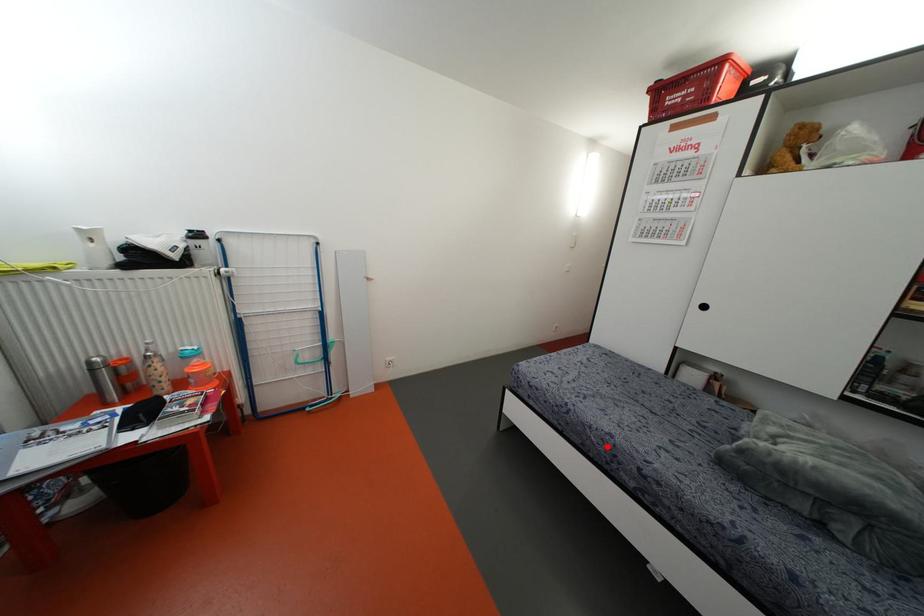
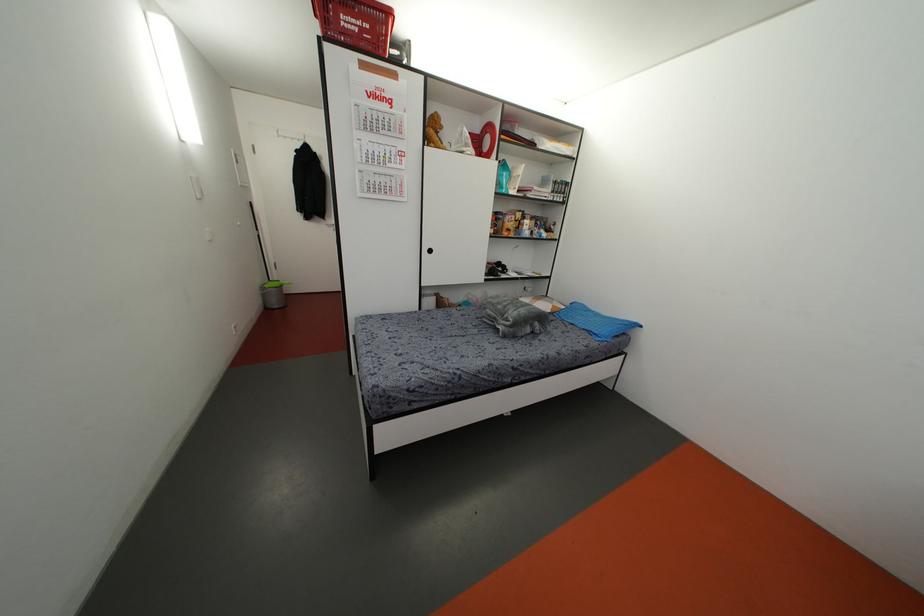
The point at the highlighted location is marked in the first image. Where is the corresponding point in the second image?

(493, 373)